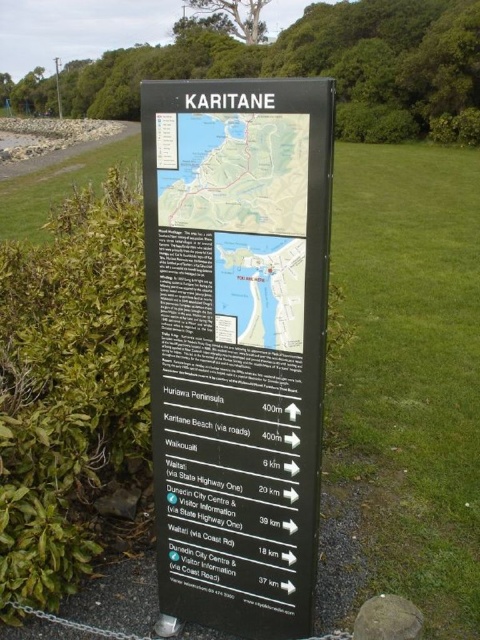
Is black plastic sign at center bigger than matte plastic map at center?

Correct, black plastic sign at center is larger in size than matte plastic map at center.

Does black plastic sign at center have a smaller size compared to matte plastic map at center?

No, black plastic sign at center is not smaller than matte plastic map at center.

Identify the location of black plastic sign at center. Image resolution: width=480 pixels, height=640 pixels. (237, 342).

Is matte plastic map at center smaller than matte black map at center?

Incorrect, matte plastic map at center is not smaller in size than matte black map at center.

From the picture: Is matte plastic map at center thinner than matte black map at center?

Incorrect, matte plastic map at center's width is not less than matte black map at center's.

Is point (245, 156) farther from camera compared to point (240, 275)?

No.

This screenshot has width=480, height=640. Identify the location of matte plastic map at center. (235, 172).

How much distance is there between black plastic sign at center and matte black map at center?

black plastic sign at center and matte black map at center are 4.79 inches apart from each other.

Is point (307, 326) positioned behind point (222, 316)?

That is False.

Does point (249, 500) come closer to viewer compared to point (302, 262)?

No, it is behind (302, 262).

You are a GUI agent. You are given a task and a screenshot of the screen. Output one action in this format:
    pyautogui.click(x=<x>, y=<y>)
    Task: Click on the black plastic sign at center
    The width and height of the screenshot is (480, 640).
    Given the screenshot: What is the action you would take?
    pyautogui.click(x=237, y=342)